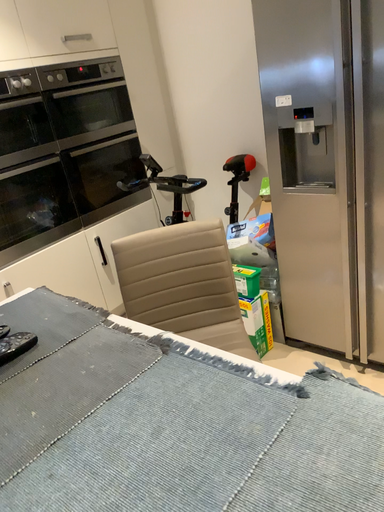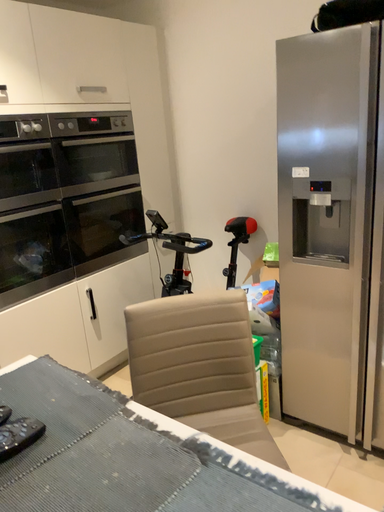
Question: Which way did the camera rotate in the video?

Choices:
 (A) rotated upward
 (B) rotated downward

Answer: (A)